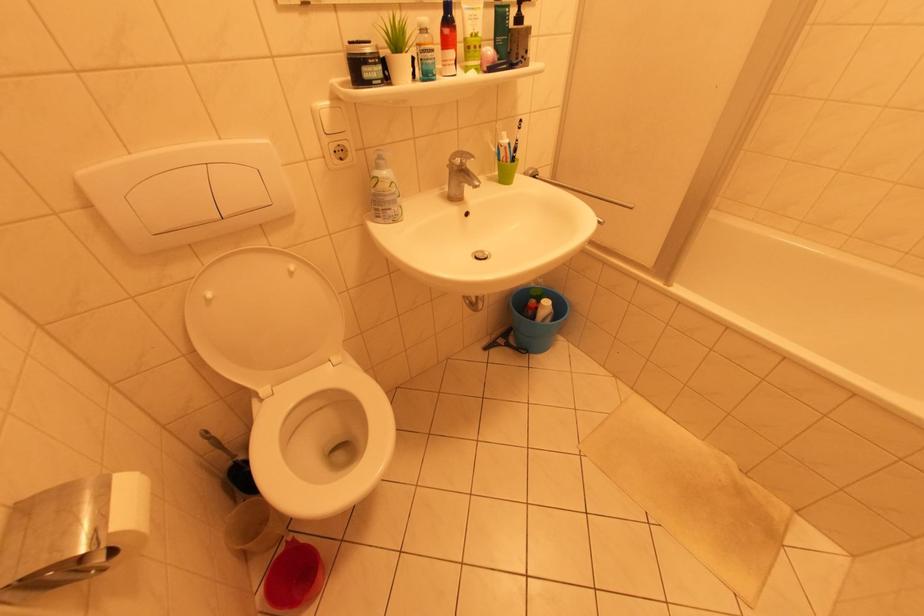
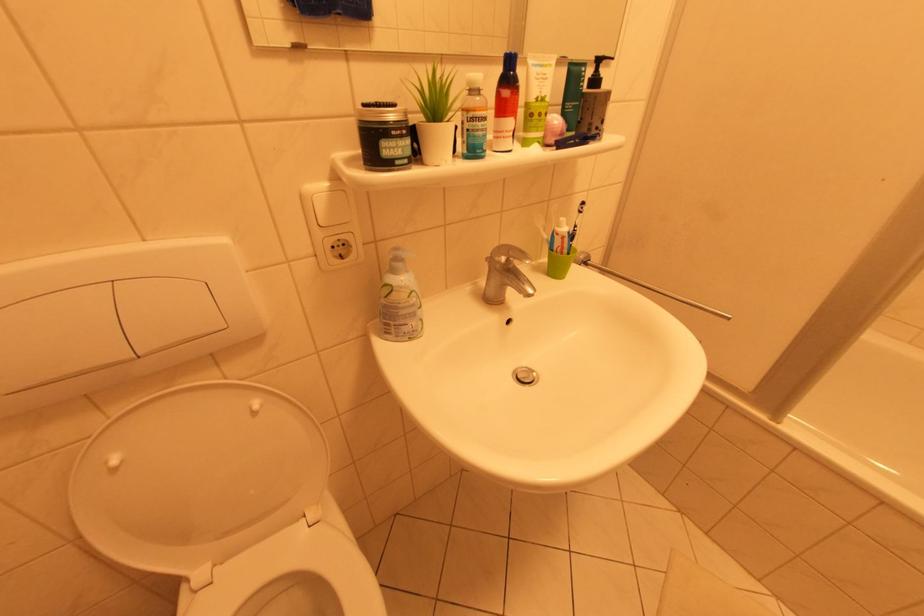
Question: In a continuous first-person perspective shot, in which direction is the camera moving?

Choices:
 (A) Left
 (B) Right
 (C) Forward
 (D) Backward

Answer: (C)